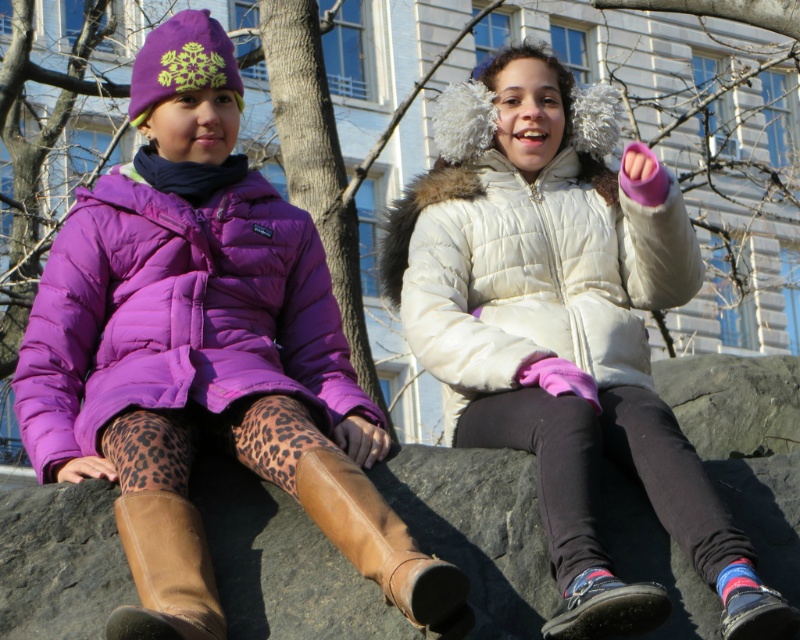
You are a photographer trying to capture a closeup of the white fluffy earmuffs at upper center without the brown leather boots at lower center appearing in the shot. Is this possible given their positions?

The brown leather boots at lower center is behind white fluffy earmuffs at upper center, so yes, you can take a closeup of the white fluffy earmuffs at upper center without the boots appearing in the shot since they are positioned behind.

You are standing in the park and see the white quilted jacket at center and the leather boot at lower left. Which object is closer to you?

The white quilted jacket at center is closer to you because the leather boot at lower left is behind it.